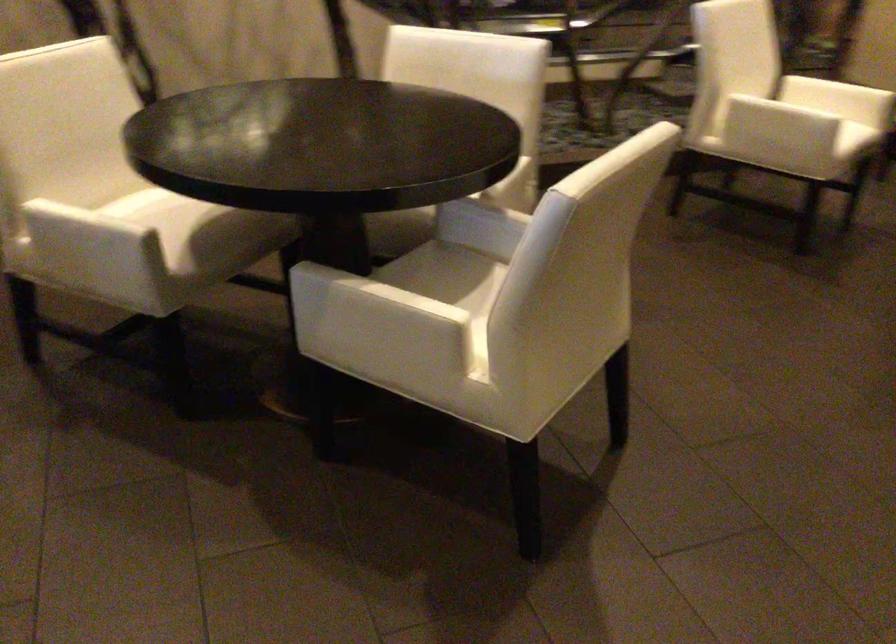
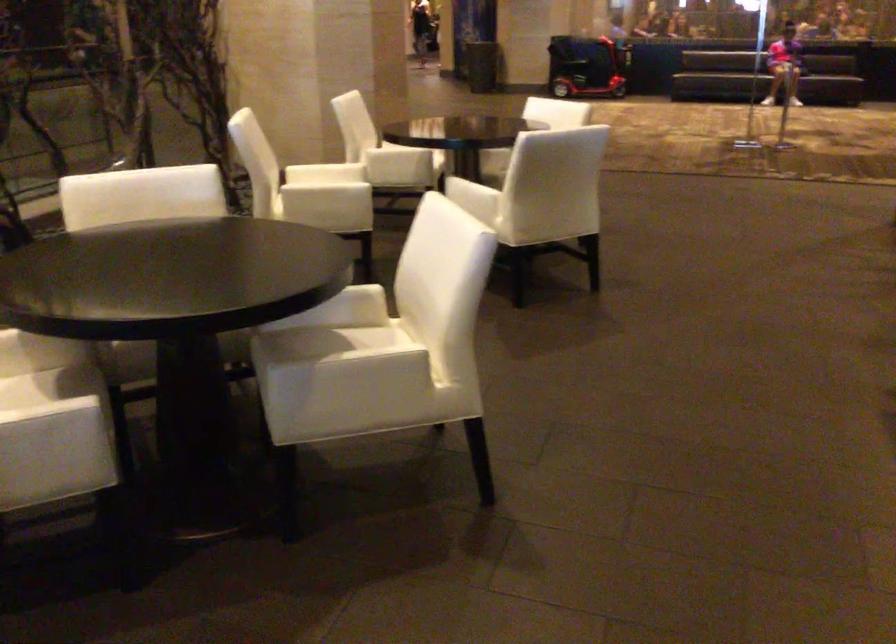
Where in the second image is the point corresponding to [116,238] from the first image?

(56, 422)